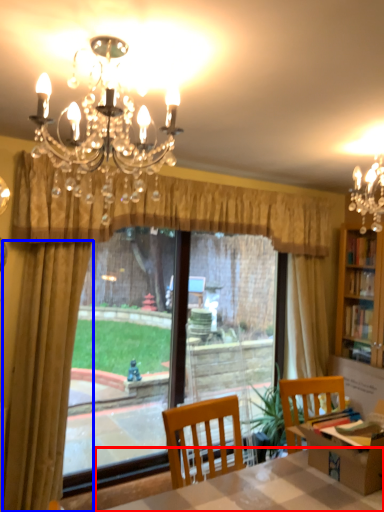
Question: Which object appears closest to the camera in this image, table (highlighted by a red box) or curtain (highlighted by a blue box)?

Choices:
 (A) table
 (B) curtain

Answer: (A)